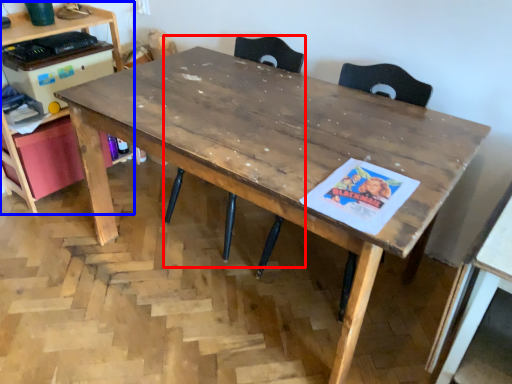
Question: Which object appears closest to the camera in this image, swivel chair (highlighted by a red box) or computer desk (highlighted by a blue box)?

Choices:
 (A) swivel chair
 (B) computer desk

Answer: (A)